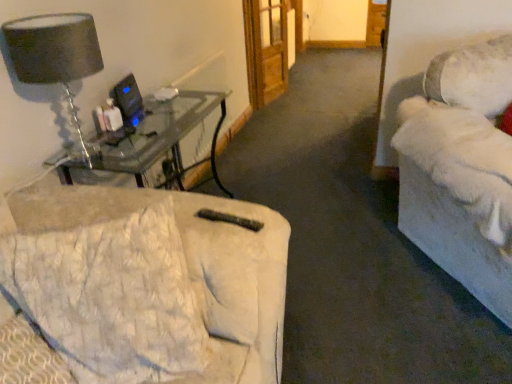
What do you see at coordinates (148, 284) in the screenshot? This screenshot has width=512, height=384. I see `white quilted fabric at lower left, placed as the 2th studio couch when sorted from right to left` at bounding box center [148, 284].

I want to click on white quilted fabric at lower left, the first studio couch positioned from the left, so click(x=148, y=284).

Looking at this image, measure the distance between point (439, 137) and camera.

The depth of point (439, 137) is 5.52 feet.

The image size is (512, 384). I want to click on wooden door at center, so click(x=269, y=49).

Find the location of a particular element. black plastic computer monitor at upper left is located at coordinates (128, 100).

Can you confirm if white plush couch at right, which is the first studio couch in right-to-left order, is thinner than matte glass table lamp at upper left?

No, white plush couch at right, which is the first studio couch in right-to-left order, is not thinner than matte glass table lamp at upper left.

From a real-world perspective, is white plush couch at right, the second studio couch from the left, on top of matte glass table lamp at upper left?

No, from a real-world perspective, white plush couch at right, the second studio couch from the left, is not above matte glass table lamp at upper left.

Where is `table lamp to the left of white plush couch at right, the second studio couch from the left`? The image size is (512, 384). table lamp to the left of white plush couch at right, the second studio couch from the left is located at coordinates (56, 56).

Considering the positions of objects wooden door at center and white plush couch at right, the second studio couch from the left, in the image provided, who is behind, wooden door at center or white plush couch at right, the second studio couch from the left,?

wooden door at center is further from the camera.

Which is nearer, (267, 25) or (509, 322)?

The point (509, 322) is more forward.

Does wooden door at center have a greater height compared to white plush couch at right, which is the first studio couch in right-to-left order?

Correct, wooden door at center is much taller as white plush couch at right, which is the first studio couch in right-to-left order.

Where is `the 1st studio couch above the wooden door at center (from a real-world perspective)`? This screenshot has height=384, width=512. the 1st studio couch above the wooden door at center (from a real-world perspective) is located at coordinates (461, 170).

Is matte glass table lamp at upper left at the right side of wooden door at center?

Incorrect, matte glass table lamp at upper left is not on the right side of wooden door at center.

Measure the distance from matte glass table lamp at upper left to wooden door at center.

A distance of 8.81 feet exists between matte glass table lamp at upper left and wooden door at center.

Where is `glass door directly beneath the matte glass table lamp at upper left (from a real-world perspective)`? The height and width of the screenshot is (384, 512). glass door directly beneath the matte glass table lamp at upper left (from a real-world perspective) is located at coordinates (269, 49).

Would you say matte glass table lamp at upper left contains wooden door at center?

No, wooden door at center is not surrounded by matte glass table lamp at upper left.

Is wooden door at center thinner than matte glass table lamp at upper left?

Indeed, wooden door at center has a lesser width compared to matte glass table lamp at upper left.

Based on the photo, is wooden door at center positioned far away from matte glass table lamp at upper left?

wooden door at center is positioned a significant distance from matte glass table lamp at upper left.

How different are the orientations of wooden door at center and matte glass table lamp at upper left in degrees?

There is a 19.2-degree angle between the facing directions of wooden door at center and matte glass table lamp at upper left.

Between white quilted fabric at lower left, the first studio couch positioned from the left, and matte glass table lamp at upper left, which one has larger width?

white quilted fabric at lower left, the first studio couch positioned from the left, is wider.

Which is in front, white quilted fabric at lower left, placed as the 2th studio couch when sorted from right to left, or matte glass table lamp at upper left?

white quilted fabric at lower left, placed as the 2th studio couch when sorted from right to left, is closer to the camera.

How much distance is there between white quilted fabric at lower left, the first studio couch positioned from the left, and matte glass table lamp at upper left?

white quilted fabric at lower left, the first studio couch positioned from the left, and matte glass table lamp at upper left are 22.45 inches apart.

Does white quilted fabric at lower left, the first studio couch positioned from the left, have a greater height compared to matte glass table lamp at upper left?

Correct, white quilted fabric at lower left, the first studio couch positioned from the left, is much taller as matte glass table lamp at upper left.

Does point (449, 65) come behind point (281, 89)?

No, (449, 65) is closer to viewer.

Is white plush couch at right, which is the first studio couch in right-to-left order, outside of wooden door at center?

Yes, white plush couch at right, which is the first studio couch in right-to-left order, is outside of wooden door at center.

Is white plush couch at right, which is the first studio couch in right-to-left order, smaller than wooden door at center?

Actually, white plush couch at right, which is the first studio couch in right-to-left order, might be larger than wooden door at center.

From the image's perspective, does white plush couch at right, the second studio couch from the left, appear lower than wooden door at center?

Correct, white plush couch at right, the second studio couch from the left, appears lower than wooden door at center in the image.

Which of these two, white quilted fabric at lower left, placed as the 2th studio couch when sorted from right to left, or black plastic computer monitor at upper left, is smaller?

With smaller size is black plastic computer monitor at upper left.

From the image's perspective, between white quilted fabric at lower left, the first studio couch positioned from the left, and black plastic computer monitor at upper left, which one is located above?

black plastic computer monitor at upper left, from the image's perspective.

How far apart are white quilted fabric at lower left, the first studio couch positioned from the left, and black plastic computer monitor at upper left?

white quilted fabric at lower left, the first studio couch positioned from the left, and black plastic computer monitor at upper left are 90.06 centimeters apart from each other.

Image resolution: width=512 pixels, height=384 pixels. I want to click on table lamp behind the white plush couch at right, which is the first studio couch in right-to-left order, so click(x=56, y=56).

Locate an element on the screen. studio couch on the right of the wooden door at center is located at coordinates (461, 170).

Estimate the real-world distances between objects in this image. Which object is further from matte glass table lamp at upper left, wooden door at center or black plastic computer monitor at upper left?

wooden door at center.

Looking at the image, which one is located closer to white plush couch at right, which is the first studio couch in right-to-left order, white quilted fabric at lower left, the first studio couch positioned from the left, or wooden door at center?

white quilted fabric at lower left, the first studio couch positioned from the left, lies closer to white plush couch at right, which is the first studio couch in right-to-left order, than the other object.

Based on their spatial positions, is matte glass table lamp at upper left or black plastic computer monitor at upper left closer to white quilted fabric at lower left, placed as the 2th studio couch when sorted from right to left?

matte glass table lamp at upper left.

From the image, which object appears to be farther from white plush couch at right, which is the first studio couch in right-to-left order, black plastic computer monitor at upper left or white quilted fabric at lower left, the first studio couch positioned from the left?

black plastic computer monitor at upper left is further to white plush couch at right, which is the first studio couch in right-to-left order.

From the image, which object appears to be farther from black plastic computer monitor at upper left, white plush couch at right, the second studio couch from the left, or wooden door at center?

wooden door at center.

Based on their spatial positions, is wooden door at center or white quilted fabric at lower left, placed as the 2th studio couch when sorted from right to left, closer to white plush couch at right, the second studio couch from the left?

white quilted fabric at lower left, placed as the 2th studio couch when sorted from right to left, is closer to white plush couch at right, the second studio couch from the left.

Looking at the image, which one is located closer to white plush couch at right, which is the first studio couch in right-to-left order, black plastic computer monitor at upper left or wooden door at center?

Among the two, black plastic computer monitor at upper left is located nearer to white plush couch at right, which is the first studio couch in right-to-left order.

Based on the photo, which object lies nearer to the anchor point matte glass table lamp at upper left, black plastic computer monitor at upper left or wooden door at center?

black plastic computer monitor at upper left.

I want to click on computer monitor between white plush couch at right, the second studio couch from the left, and wooden door at center in the front-back direction, so click(128, 100).

Where is `studio couch between white quilted fabric at lower left, placed as the 2th studio couch when sorted from right to left, and wooden door at center from front to back`? The image size is (512, 384). studio couch between white quilted fabric at lower left, placed as the 2th studio couch when sorted from right to left, and wooden door at center from front to back is located at coordinates (461, 170).

Where is `table lamp located between white plush couch at right, which is the first studio couch in right-to-left order, and wooden door at center in the depth direction`? The height and width of the screenshot is (384, 512). table lamp located between white plush couch at right, which is the first studio couch in right-to-left order, and wooden door at center in the depth direction is located at coordinates (56, 56).

Locate an element on the screen. computer monitor between matte glass table lamp at upper left and wooden door at center along the z-axis is located at coordinates (128, 100).